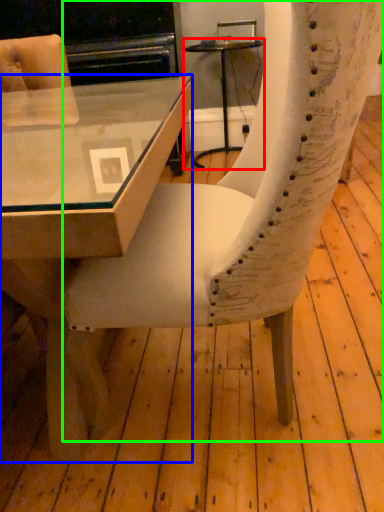
Question: Which is nearer to the table (highlighted by a red box)? table (highlighted by a blue box) or chair (highlighted by a green box).

Choices:
 (A) table
 (B) chair

Answer: (A)